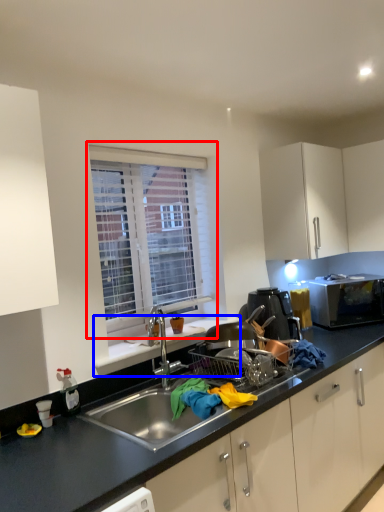
Question: Among these objects, which one is farthest to the camera, window (highlighted by a red box) or window sill (highlighted by a blue box)?

Choices:
 (A) window
 (B) window sill

Answer: (A)